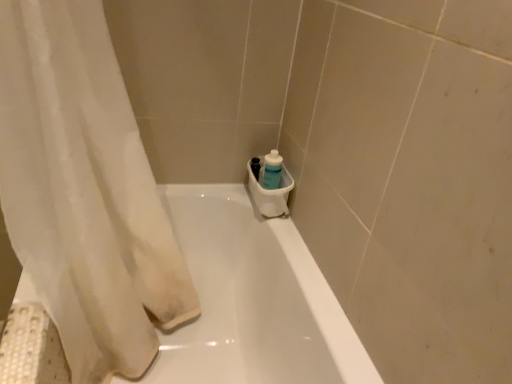
Question: Is the position of white sheer curtain at left less distant than that of white glossy bathtub at center?

Choices:
 (A) yes
 (B) no

Answer: (A)

Question: Are white sheer curtain at left and white glossy bathtub at center far apart?

Choices:
 (A) no
 (B) yes

Answer: (A)

Question: Is white glossy bathtub at center at the back of white sheer curtain at left?

Choices:
 (A) no
 (B) yes

Answer: (B)

Question: Is white sheer curtain at left bigger than white glossy bathtub at center?

Choices:
 (A) no
 (B) yes

Answer: (A)

Question: From the image's perspective, is white sheer curtain at left beneath white glossy bathtub at center?

Choices:
 (A) yes
 (B) no

Answer: (B)

Question: Could you tell me if white sheer curtain at left is turned towards white glossy bathtub at center?

Choices:
 (A) no
 (B) yes

Answer: (A)

Question: Considering the relative positions of white sheer curtain at left and translucent plastic bottle at lower right in the image provided, is white sheer curtain at left to the left of translucent plastic bottle at lower right from the viewer's perspective?

Choices:
 (A) no
 (B) yes

Answer: (B)

Question: Considering the relative sizes of white sheer curtain at left and translucent plastic bottle at lower right in the image provided, is white sheer curtain at left thinner than translucent plastic bottle at lower right?

Choices:
 (A) yes
 (B) no

Answer: (B)

Question: Is the position of white sheer curtain at left less distant than that of translucent plastic bottle at lower right?

Choices:
 (A) yes
 (B) no

Answer: (A)

Question: From a real-world perspective, is white sheer curtain at left located higher than translucent plastic bottle at lower right?

Choices:
 (A) no
 (B) yes

Answer: (B)

Question: Is white sheer curtain at left turned away from translucent plastic bottle at lower right?

Choices:
 (A) no
 (B) yes

Answer: (B)

Question: From a real-world perspective, is white sheer curtain at left under translucent plastic bottle at lower right?

Choices:
 (A) no
 (B) yes

Answer: (A)

Question: Is translucent plastic bottle at lower right thinner than white glossy bathtub at center?

Choices:
 (A) yes
 (B) no

Answer: (A)